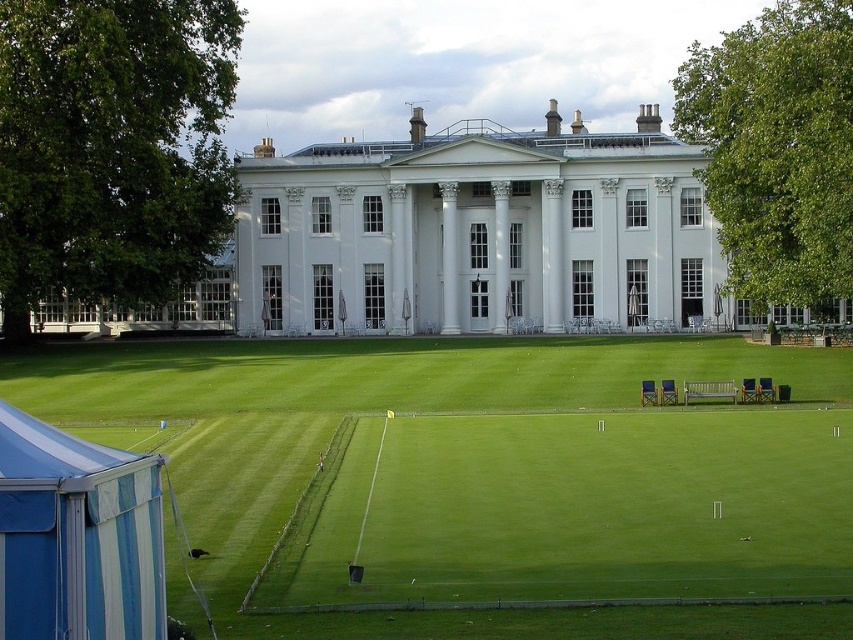
You are planning to set up a picnic area near the blue striped tent at lower left and the green grass at center. Based on the scene, which object is closer to you as you face the building?

The green grass at center is closer to you because the blue striped tent at lower left is behind it.

You are standing at the entrance of the white building and want to find the green grass at center. According to the coordinates provided, in which direction should you walk to reach it?

The green grass at center is located at coordinates point (x=490, y=477), so you should walk forward and to the right from the entrance to reach it.